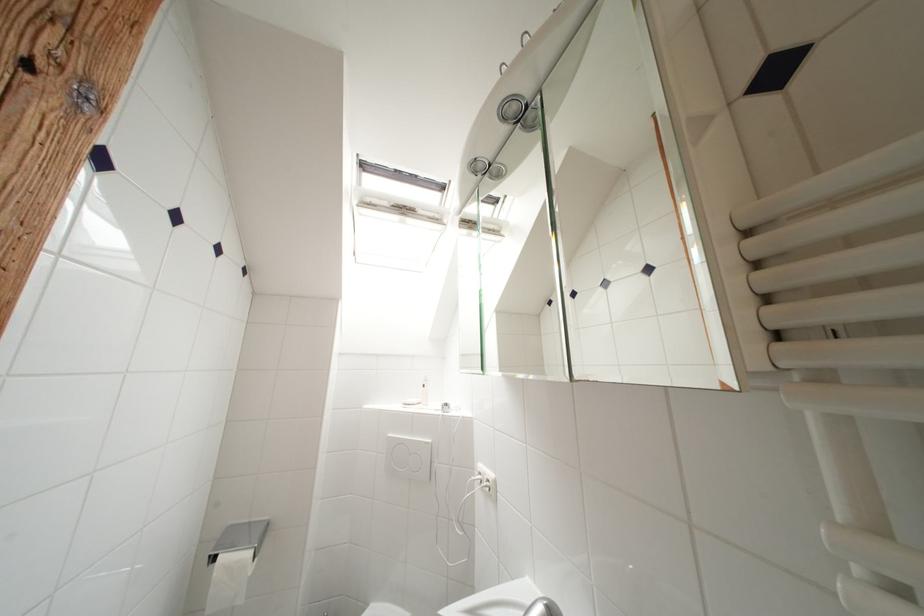
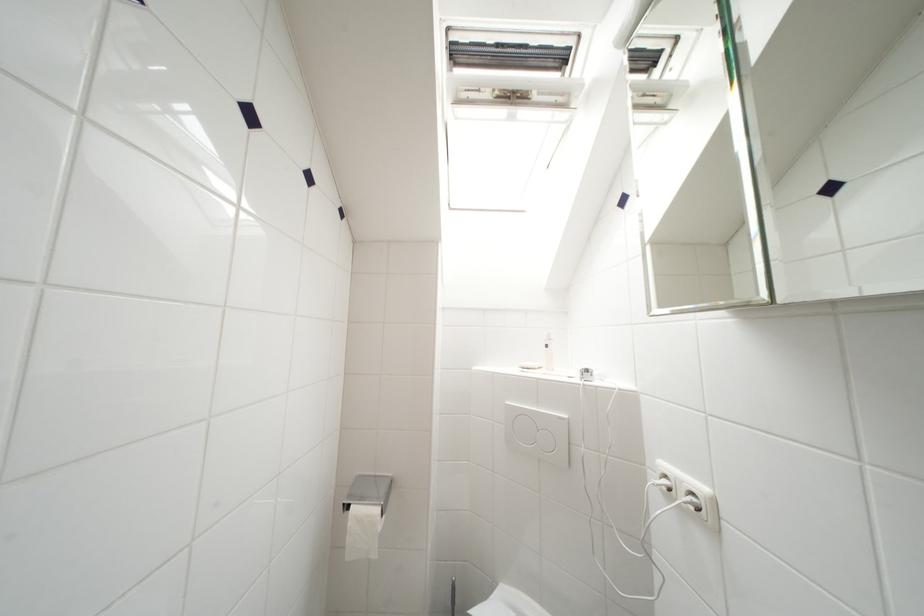
What movement of the cameraman would produce the second image?

The cameraman moved toward left, forward.